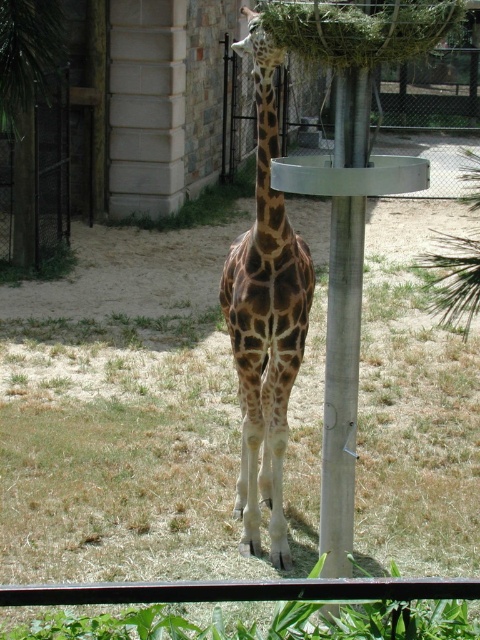
Question: Which of the following is the farthest from the observer?

Choices:
 (A) (70, 477)
 (B) (345, 93)
 (C) (301, 250)

Answer: (A)

Question: Is green grass at center smaller than spotted fur giraffe at center?

Choices:
 (A) yes
 (B) no

Answer: (B)

Question: Does green grass at center lie in front of spotted fur giraffe at center?

Choices:
 (A) no
 (B) yes

Answer: (A)

Question: Estimate the real-world distances between objects in this image. Which object is farther from the green grass at center?

Choices:
 (A) spotted fur giraffe at center
 (B) metallic pole at center

Answer: (B)

Question: Among these objects, which one is nearest to the camera?

Choices:
 (A) green grass at center
 (B) spotted fur giraffe at center
 (C) metallic pole at center

Answer: (C)

Question: Does green grass at center have a smaller size compared to spotted fur giraffe at center?

Choices:
 (A) yes
 (B) no

Answer: (B)